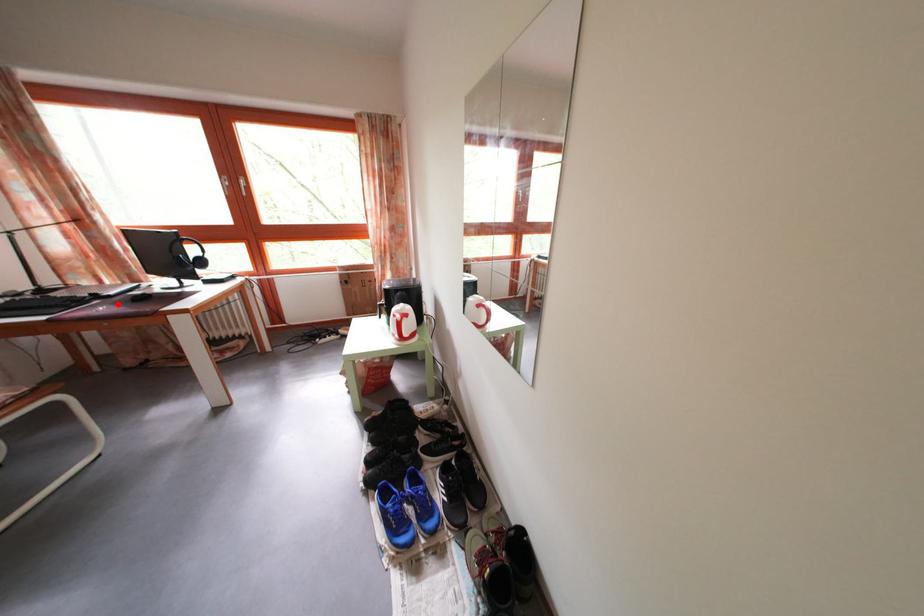
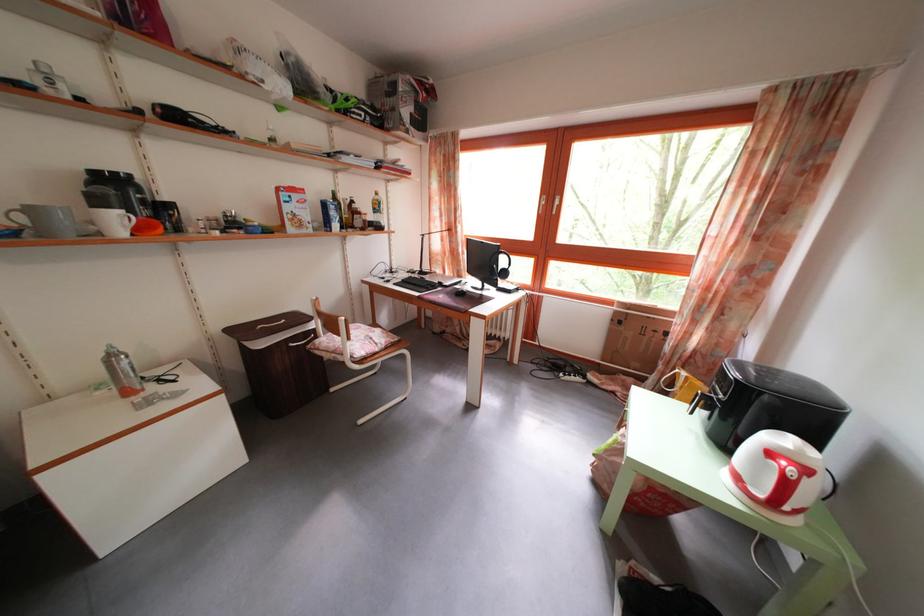
The point at the highlighted location is marked in the first image. Where is the corresponding point in the second image?

(454, 294)